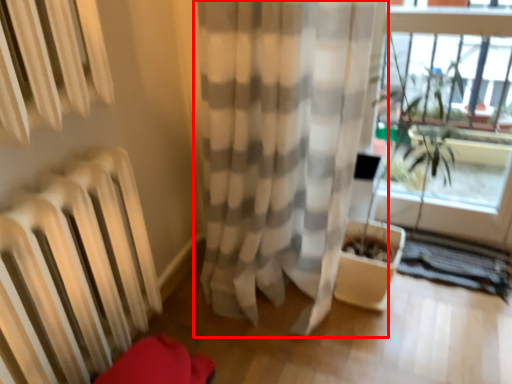
Question: From the image's perspective, where is curtain (annotated by the red box) located in relation to window frame in the image?

Choices:
 (A) above
 (B) below

Answer: (B)